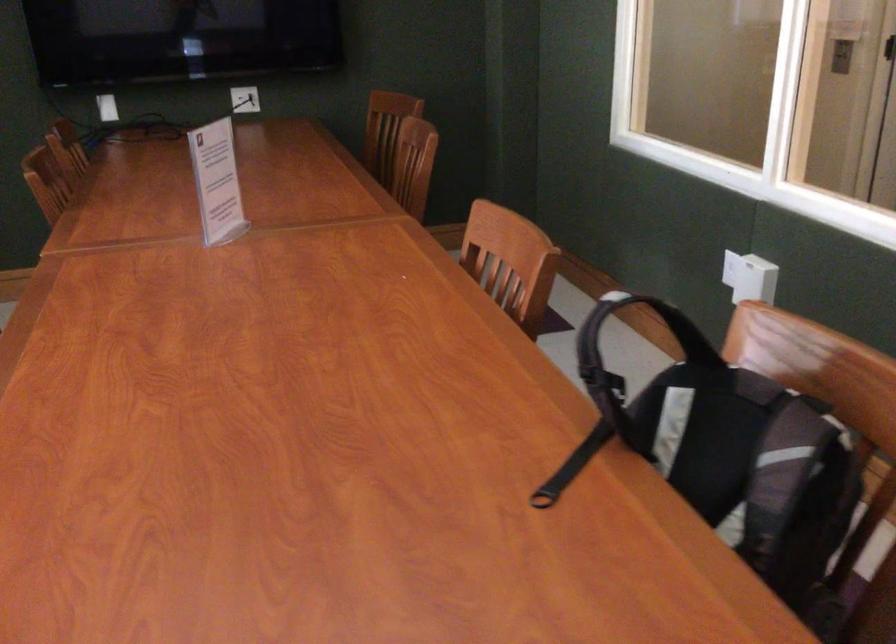
Where would you lift the backpack handle? Please return your answer as a coordinate pair (x, y).

(572, 466)